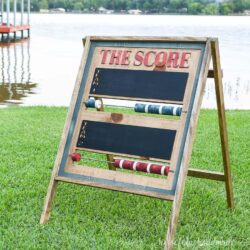
Locate an element on the screen. blue adornments is located at coordinates (153, 109), (90, 103).